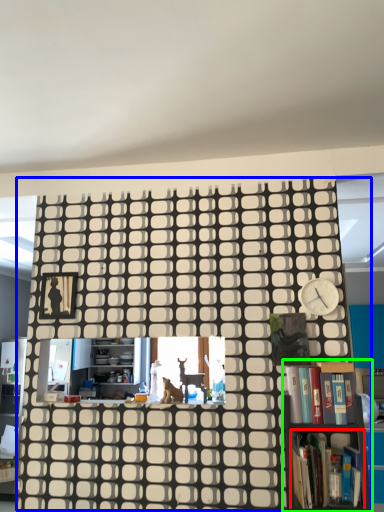
Question: Based on their relative distances, which object is farther from book (highlighted by a red box)? Choose from bookcase (highlighted by a blue box) and bookcase (highlighted by a green box).

Choices:
 (A) bookcase
 (B) bookcase

Answer: (A)